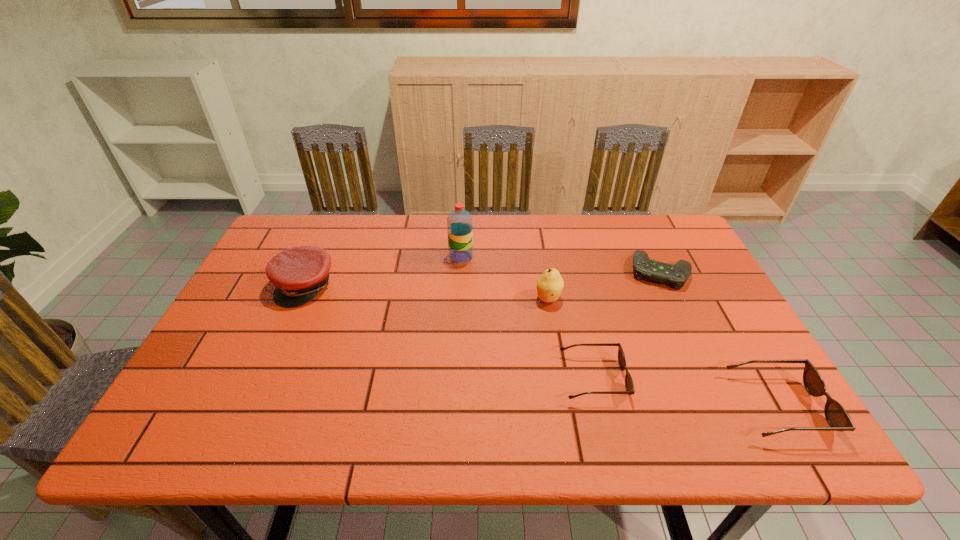
This screenshot has height=540, width=960. I want to click on vacant spot to place a sunglasses on the left, so click(x=427, y=353).